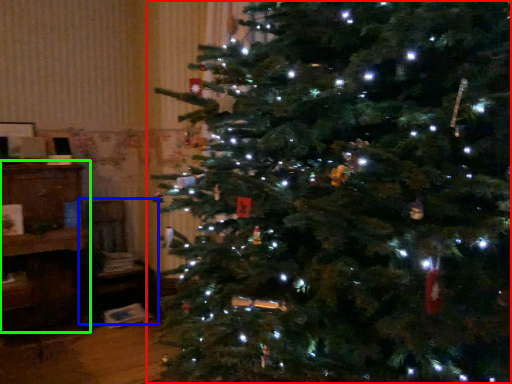
Question: Which is farther away from christmas tree (highlighted by a red box)? chair (highlighted by a blue box) or furniture (highlighted by a green box)?

Choices:
 (A) chair
 (B) furniture

Answer: (A)